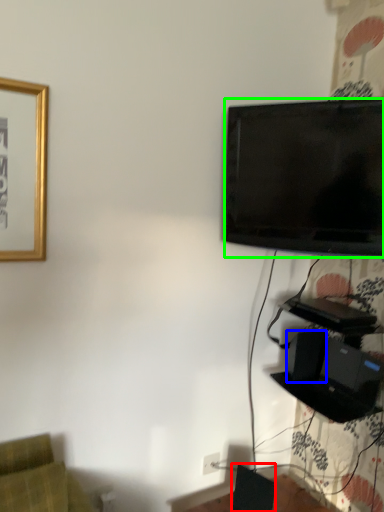
Question: Based on their relative distances, which object is nearer to speaker (highlighted by a red box)? Choose from speaker (highlighted by a blue box) and television (highlighted by a green box).

Choices:
 (A) speaker
 (B) television

Answer: (A)